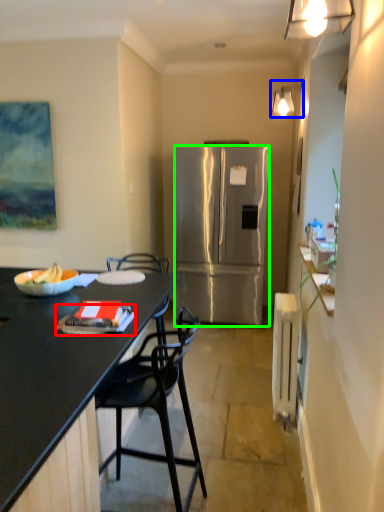
Question: Which is farther away from book (highlighted by a red box)? lamp (highlighted by a blue box) or refrigerator (highlighted by a green box)?

Choices:
 (A) lamp
 (B) refrigerator

Answer: (A)